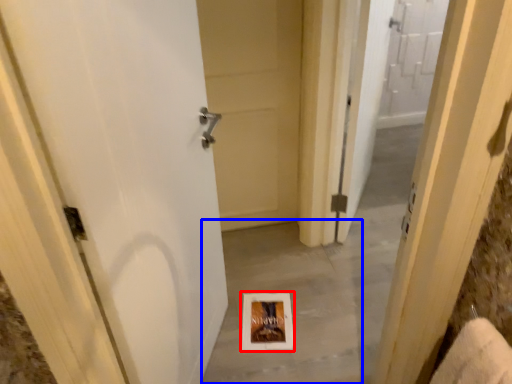
Question: Which object is further to the camera taking this photo, picture frame (highlighted by a red box) or concrete (highlighted by a blue box)?

Choices:
 (A) picture frame
 (B) concrete

Answer: (A)